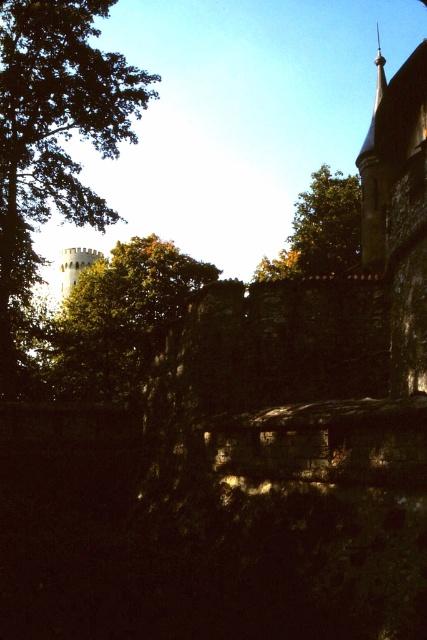
You are standing in front of the medieval stone structure and notice a point marked at coordinates (119,317). What object does this point correspond to?

The point at coordinates (119,317) corresponds to the green leafy tree at upper left.

You are an architect inspecting the medieval stone structure. You notice the green leafy tree at left and the white stone water tower at left. Which object is positioned higher in the scene?

The green leafy tree at left is located above the white stone water tower at left, so it is positioned higher in the scene.

You are standing in front of the medieval stone structure and notice two green leafy trees in the upper part of the scene. Which tree is nearer to you, the green leafy tree at upper left or the green leafy tree at upper center?

The green leafy tree at upper left is closer to the viewer than the green leafy tree at upper center.